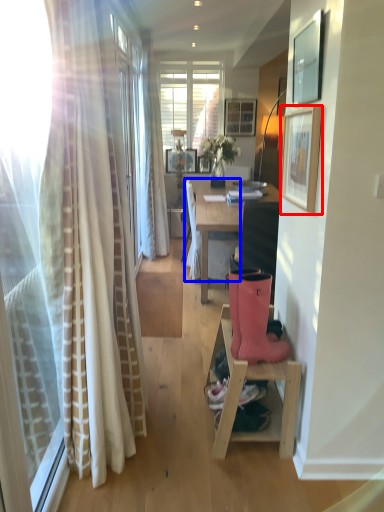
Question: Which object appears farthest to the camera in this image, picture frame (highlighted by a red box) or chair (highlighted by a blue box)?

Choices:
 (A) picture frame
 (B) chair

Answer: (B)